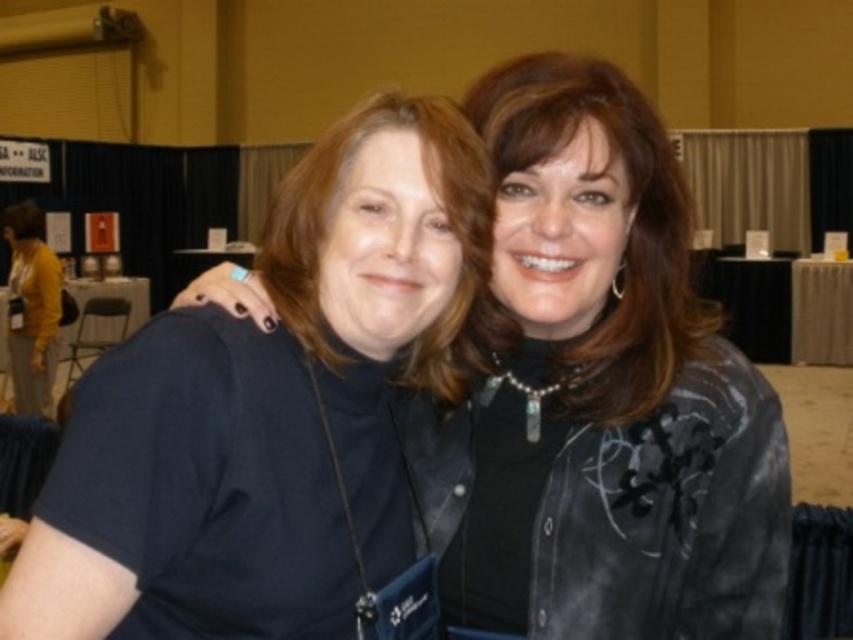
Question: Among these points, which one is farthest from the camera?

Choices:
 (A) (595, 280)
 (B) (186, 406)

Answer: (A)

Question: Does matte black jacket at center have a greater width compared to black fabric shirt at center?

Choices:
 (A) no
 (B) yes

Answer: (A)

Question: Which of the following is the farthest from the observer?

Choices:
 (A) (64, 493)
 (B) (515, 484)

Answer: (B)

Question: Is matte black jacket at center thinner than black fabric shirt at center?

Choices:
 (A) yes
 (B) no

Answer: (A)

Question: Among these points, which one is nearest to the camera?

Choices:
 (A) (343, 380)
 (B) (476, 481)

Answer: (A)

Question: Is the position of matte black jacket at center more distant than that of black fabric shirt at center?

Choices:
 (A) no
 (B) yes

Answer: (B)